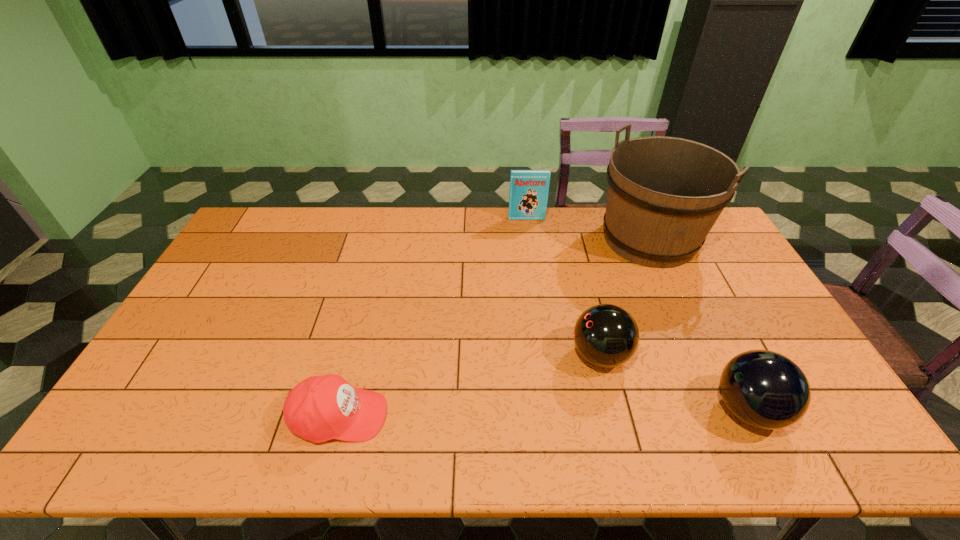
The height and width of the screenshot is (540, 960). What are the coordinates of `bowling ball at the right edge` in the screenshot? It's located at (764, 389).

What are the coordinates of `object positioned at the far right corner` in the screenshot? It's located at pyautogui.click(x=664, y=194).

Image resolution: width=960 pixels, height=540 pixels. What are the coordinates of `object at the near right corner` in the screenshot? It's located at pos(764,389).

Where is `free region at the far edge`? Image resolution: width=960 pixels, height=540 pixels. free region at the far edge is located at coordinates (407, 213).

In the image, there is a desktop. In order to click on vacant space at the near edge in this screenshot , I will do `click(745, 449)`.

Identify the location of free location at the left edge of the desktop. (182, 363).

This screenshot has height=540, width=960. I want to click on vacant space at the right edge of the desktop, so pos(705,274).

I want to click on vacant area at the far left corner, so click(274, 241).

Identify the location of free spot between the fourth object from right to left and the right bowling ball. The height and width of the screenshot is (540, 960). (637, 314).

Find the location of a particular element. free space between the right bowling ball and the left bowling ball is located at coordinates (674, 382).